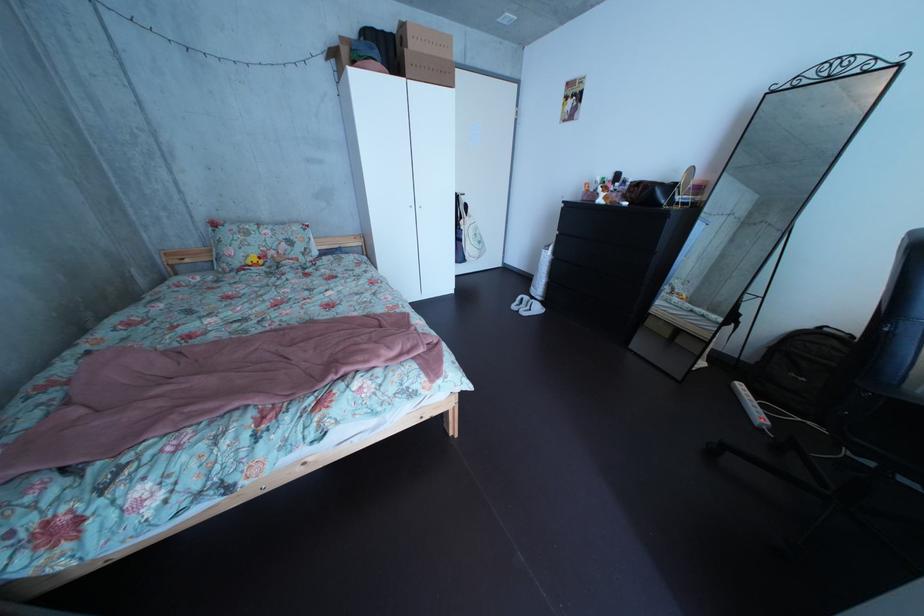
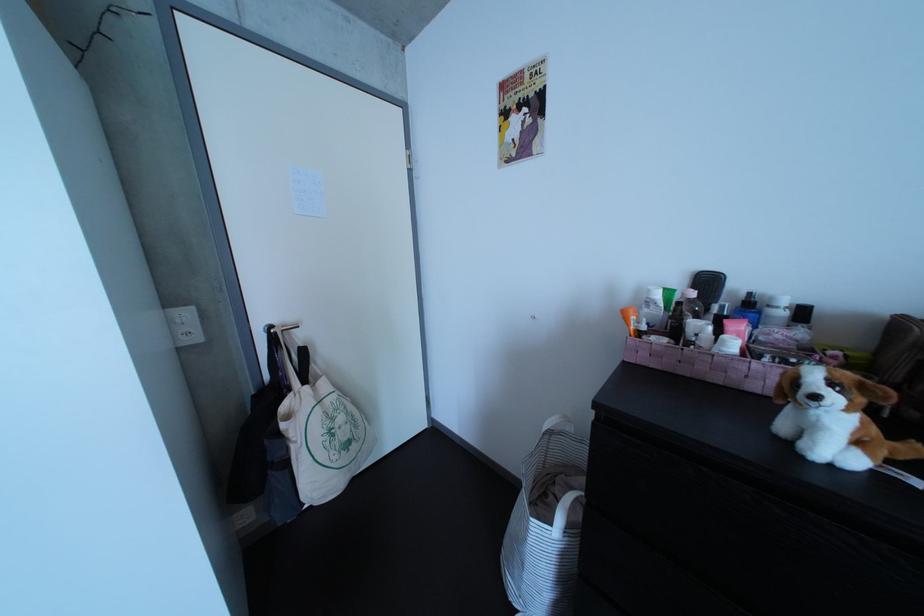
Question: What movement of the cameraman would produce the second image?

Choices:
 (A) Left
 (B) Right
 (C) Forward
 (D) Backward

Answer: (C)